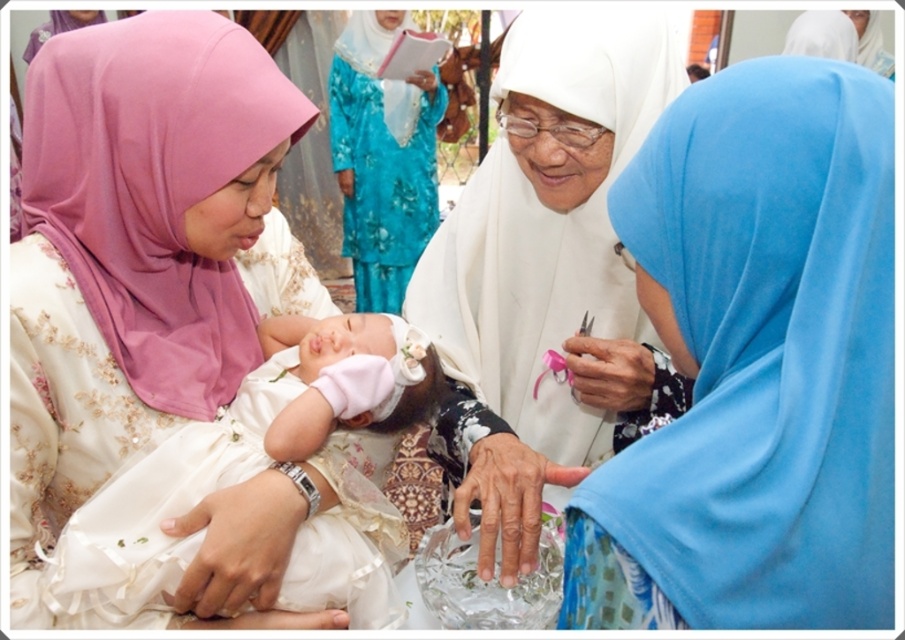
Is point (498, 276) in front of point (121, 508)?

No, (498, 276) is further to viewer.

Is point (613, 308) farther from viewer compared to point (56, 595)?

Yes, point (613, 308) is behind point (56, 595).

Who is more forward, (498, 518) or (148, 472)?

Point (148, 472) is more forward.

Locate an element on the screen. Image resolution: width=905 pixels, height=640 pixels. white satin hijab at center is located at coordinates (541, 269).

Locate an element on the screen. The image size is (905, 640). blue fabric headscarf at right is located at coordinates (755, 364).

Is blue fabric headscarf at right behind matte pink hijab at upper left?

No, it is in front of matte pink hijab at upper left.

Does point (763, 380) lie in front of point (143, 288)?

Yes, it is in front of point (143, 288).

Identify the location of blue fabric headscarf at right. This screenshot has width=905, height=640. [x=755, y=364].

Does white satin dress at center have a greater width compared to dry skin hand at center?

Correct, the width of white satin dress at center exceeds that of dry skin hand at center.

Does point (137, 563) come in front of point (465, 483)?

Yes.

The image size is (905, 640). I want to click on white satin dress at center, so click(x=237, y=452).